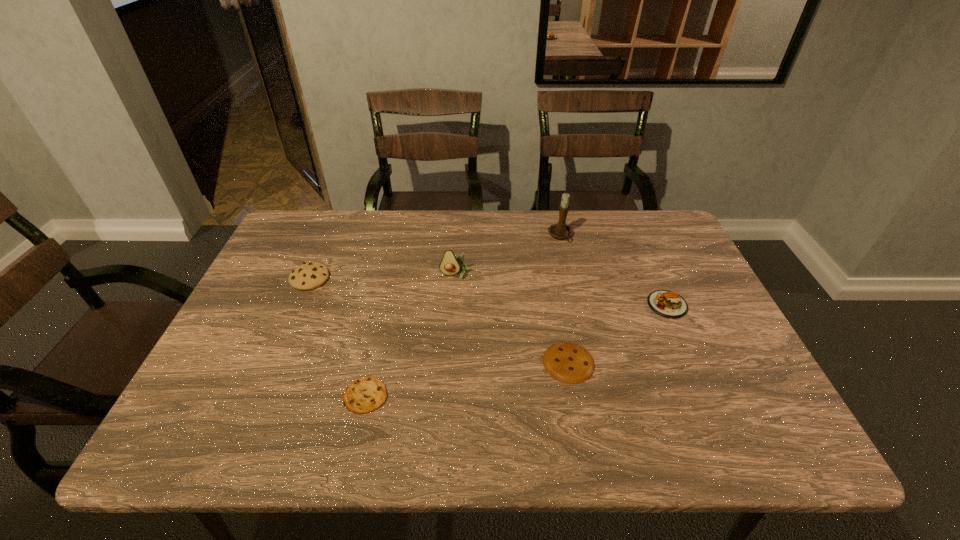
The width and height of the screenshot is (960, 540). What are the coordinates of `vacant space located 0.090m on the seed side of the fourth object from right to left` in the screenshot? It's located at (455, 305).

The image size is (960, 540). I want to click on blank space located on the back of the leftmost object, so click(325, 242).

I want to click on free space located 0.050m on the back of the patty (food), so click(x=656, y=279).

Identify the location of free spot located on the right of the rightmost cookie. This screenshot has width=960, height=540. (625, 362).

What are the coordinates of `blank space located on the back of the second object from left to right` in the screenshot? It's located at (377, 343).

The width and height of the screenshot is (960, 540). In order to click on object at the far edge in this screenshot , I will do `click(560, 230)`.

Where is `object that is at the near edge`? object that is at the near edge is located at coordinates click(x=366, y=394).

You are a GUI agent. You are given a task and a screenshot of the screen. Output one action in this format:
    pyautogui.click(x=<x>, y=<y>)
    Task: Click on the object present at the left edge
    The height and width of the screenshot is (540, 960).
    Given the screenshot: What is the action you would take?
    point(311,275)

At what (x,y) coordinates should I click in order to perform the action: click on object present at the right edge. Please return your answer as a coordinate pair (x, y). This screenshot has height=540, width=960. Looking at the image, I should click on (668, 304).

Image resolution: width=960 pixels, height=540 pixels. I want to click on vacant space at the far edge of the desktop, so click(x=550, y=211).